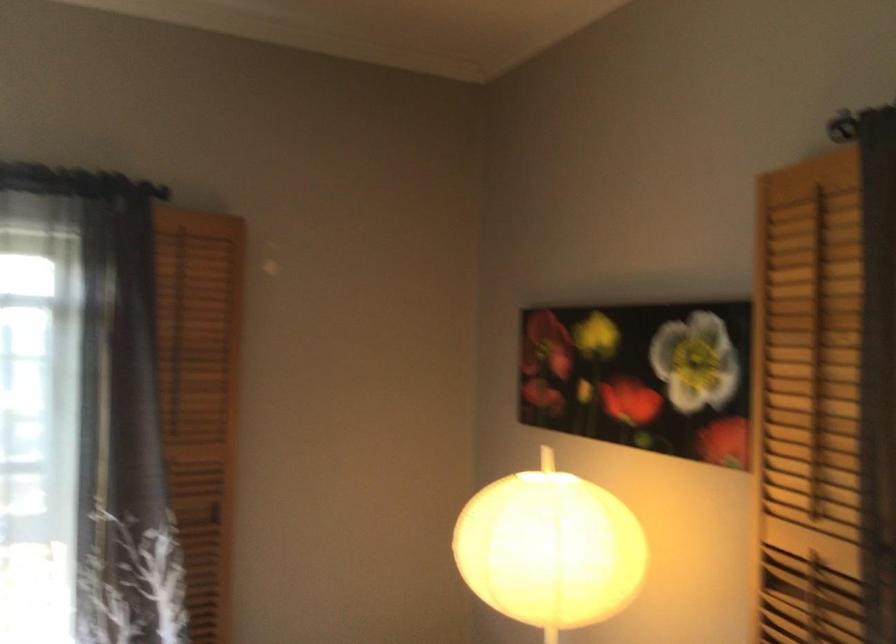
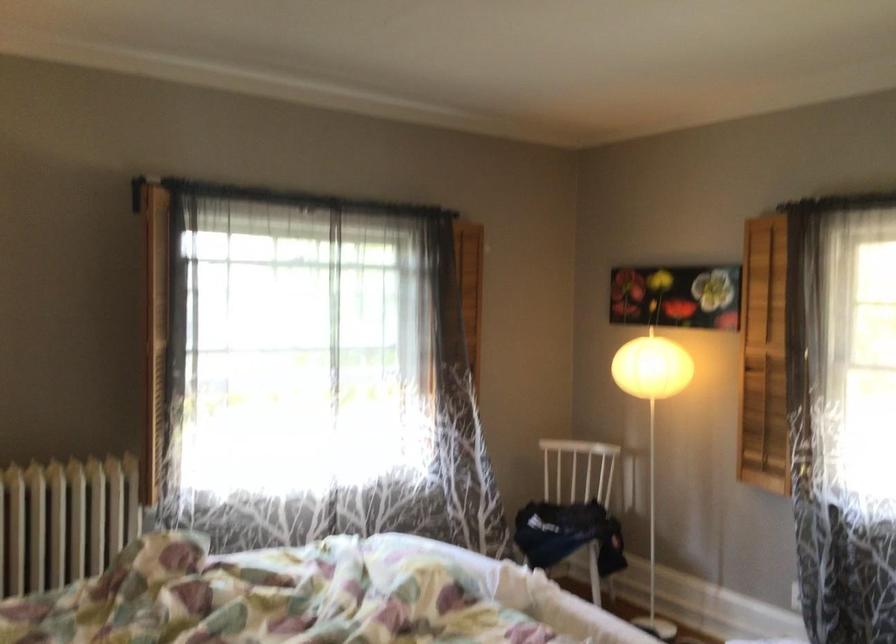
In a continuous first-person perspective shot, in which direction is the camera moving?

The cameraman moved toward left, backward.